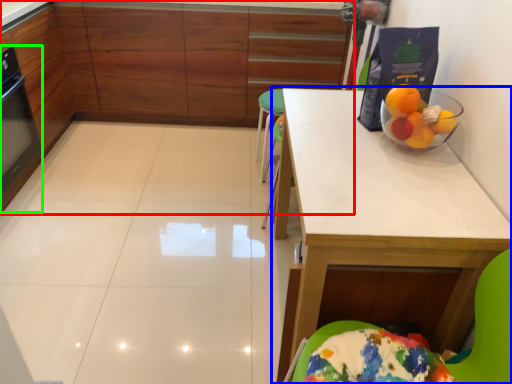
Question: Estimate the real-world distances between objects in this image. Which object is farther from cabinetry (highlighted by a red box), table (highlighted by a blue box) or appliance (highlighted by a green box)?

Choices:
 (A) table
 (B) appliance

Answer: (A)